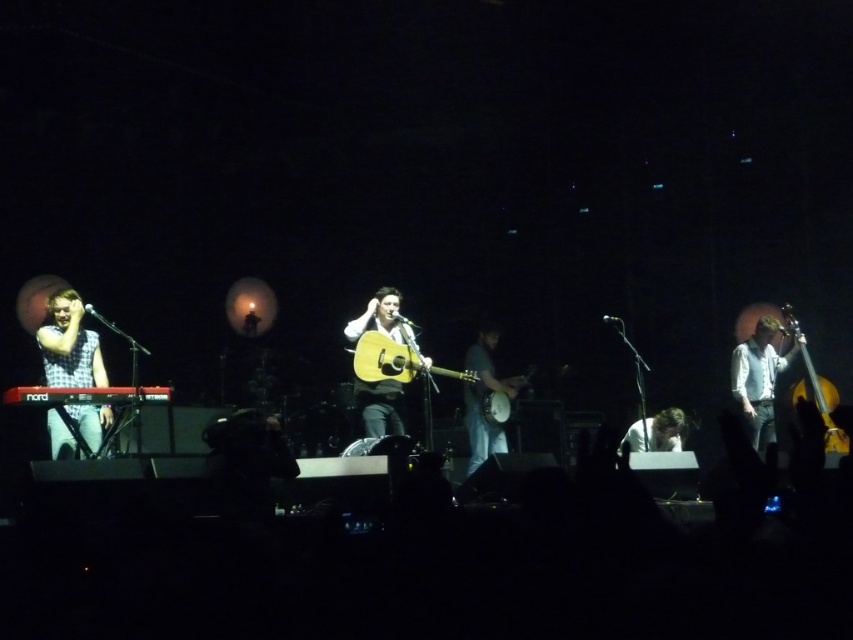
Question: Does checkered fabric keyboard at lower left have a smaller size compared to light brown acoustic guitar at center?

Choices:
 (A) no
 (B) yes

Answer: (A)

Question: Which point is farther to the camera?

Choices:
 (A) blue denim jeans at center
 (B) shiny silver bass at right
 (C) black matte keyboard at lower left
 (D) shiny gold guitar at right

Answer: (A)

Question: Is blue denim jeans at center smaller than wooden acoustic guitar at center?

Choices:
 (A) no
 (B) yes

Answer: (A)

Question: Which of the following is the farthest from the observer?

Choices:
 (A) (780, 324)
 (B) (57, 400)

Answer: (A)

Question: Does shiny silver bass at right have a greater width compared to black matte keyboard at lower left?

Choices:
 (A) no
 (B) yes

Answer: (A)

Question: Which point is farther to the camera?

Choices:
 (A) acoustic guitar at center
 (B) blue denim jeans at center
 (C) shiny gold guitar at right
 (D) shiny silver bass at right

Answer: (B)